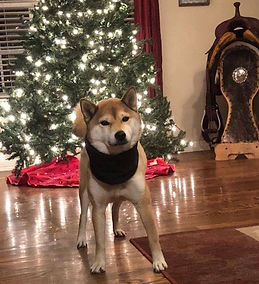
In order to click on floor in this screenshot , I will do `click(200, 186)`, `click(39, 240)`.